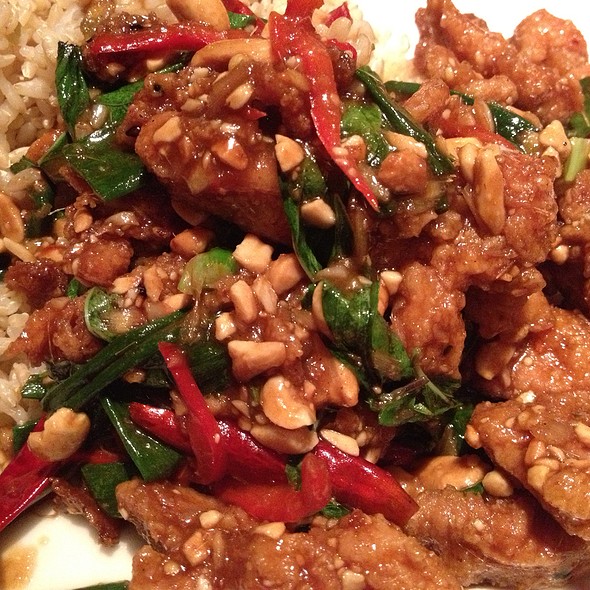
Identify the location of sauce on plate. Image resolution: width=590 pixels, height=590 pixels. (15, 572).